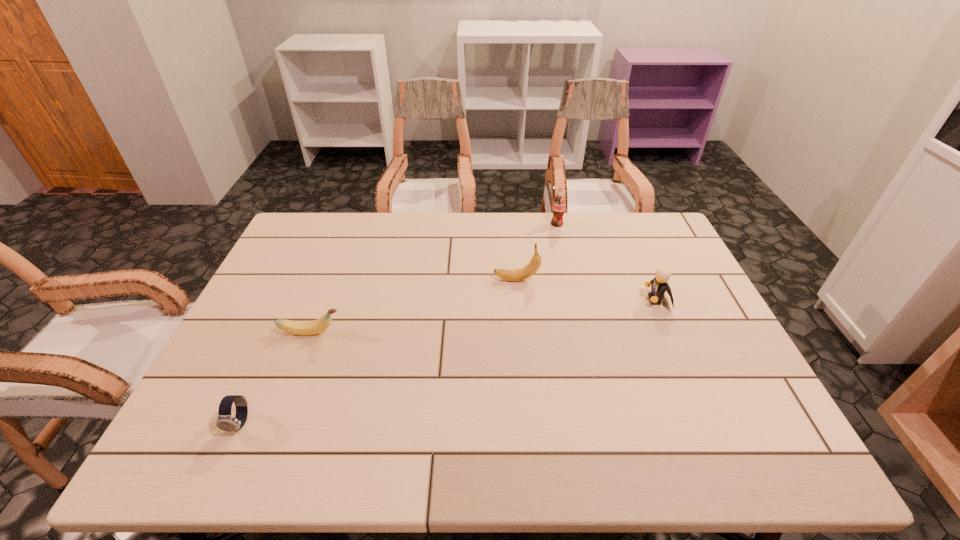
Where is `the farthest object`? The height and width of the screenshot is (540, 960). the farthest object is located at coordinates (559, 204).

The height and width of the screenshot is (540, 960). Identify the location of the fourth object from left to right. (559, 204).

Locate an element on the screen. The width and height of the screenshot is (960, 540). the right banana is located at coordinates (530, 269).

Identify the location of the third object from right to left. The width and height of the screenshot is (960, 540). (530, 269).

Identify the location of the third tallest object. (659, 285).

This screenshot has height=540, width=960. I want to click on Lego, so click(659, 285).

Where is `the second nearest object`? the second nearest object is located at coordinates (293, 327).

Find the location of a particular element. The height and width of the screenshot is (540, 960). the left banana is located at coordinates (293, 327).

Locate an element on the screen. This screenshot has height=540, width=960. watch is located at coordinates (226, 422).

Where is `vacant area situated 0.280m on the left of the farthest object`? The image size is (960, 540). vacant area situated 0.280m on the left of the farthest object is located at coordinates (470, 224).